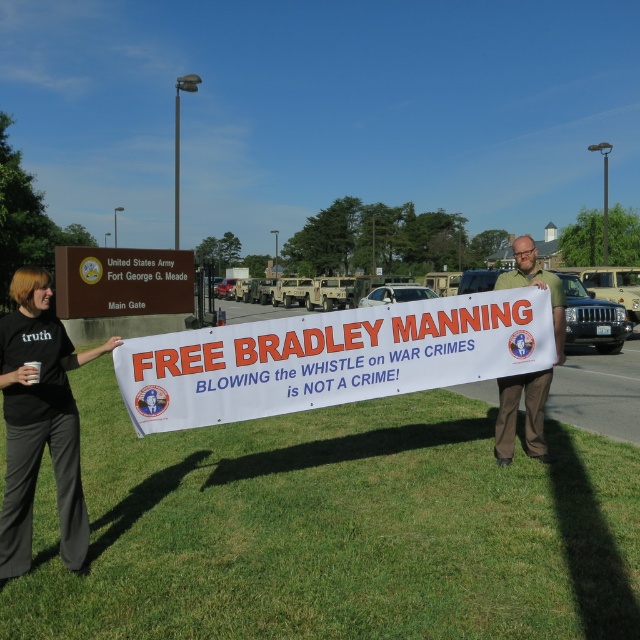
Question: Is green grass at lower center above black fabric shirt at lower left?

Choices:
 (A) no
 (B) yes

Answer: (A)

Question: Which object is farther from the camera taking this photo?

Choices:
 (A) green fabric sign at center
 (B) green grass at lower center
 (C) black fabric shirt at lower left
 (D) white paper banner at center

Answer: (D)

Question: In this image, where is green grass at lower center located relative to black fabric shirt at lower left?

Choices:
 (A) left
 (B) right

Answer: (B)

Question: Can you confirm if white fabric banner at center is positioned to the left of white paper banner at center?

Choices:
 (A) no
 (B) yes

Answer: (A)

Question: Which of these objects is positioned farthest from the green grass at lower center?

Choices:
 (A) green fabric sign at center
 (B) white paper banner at center

Answer: (B)

Question: Considering the real-world distances, which object is farthest from the green grass at lower center?

Choices:
 (A) white fabric banner at center
 (B) white paper banner at center
 (C) black fabric shirt at lower left
 (D) green fabric sign at center

Answer: (B)